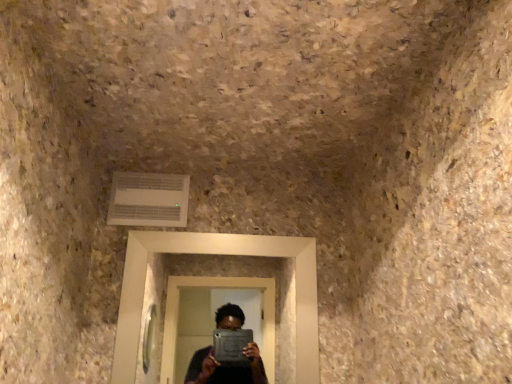
This screenshot has height=384, width=512. I want to click on matte gray mirror at center, so click(x=218, y=254).

What do you see at coordinates (218, 254) in the screenshot?
I see `matte gray mirror at center` at bounding box center [218, 254].

At what (x,y) coordinates should I click in order to perform the action: click on matte gray mirror at center. Please return your answer as a coordinate pair (x, y). The height and width of the screenshot is (384, 512). Looking at the image, I should click on (218, 254).